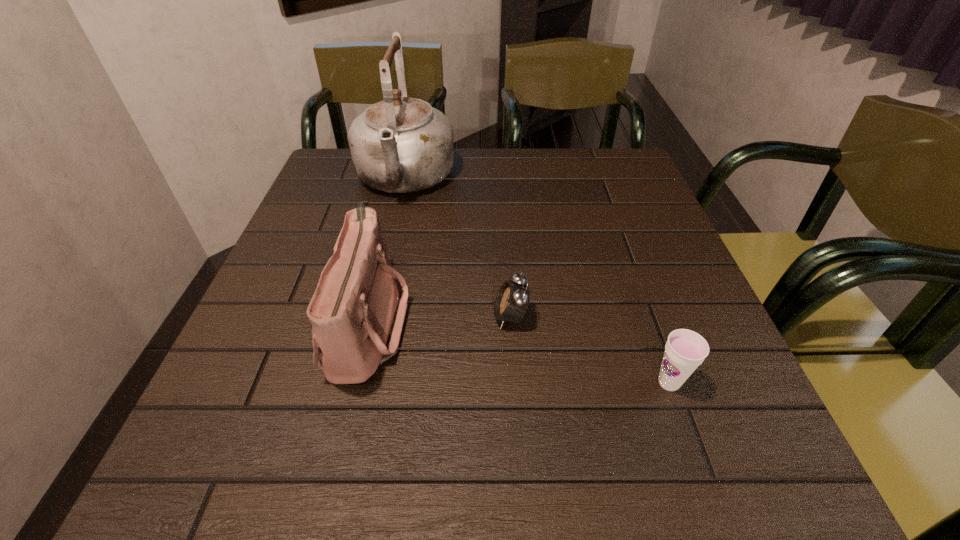
Identify the location of vacant space at the far left corner of the desktop. (347, 152).

Identify the location of vacant space at the far right corner of the desktop. The image size is (960, 540). (634, 185).

You are a GUI agent. You are given a task and a screenshot of the screen. Output one action in this format:
    pyautogui.click(x=<x>, y=<y>)
    Task: Click on the vacant space that is in between the alarm clock and the shoulder bag
    The height and width of the screenshot is (540, 960).
    Given the screenshot: What is the action you would take?
    click(x=439, y=319)

Identify the location of vacant space that is in between the kettle and the third object from left to right. This screenshot has width=960, height=540. (457, 248).

I want to click on empty space that is in between the kettle and the alarm clock, so click(457, 248).

The width and height of the screenshot is (960, 540). I want to click on blank region between the second object from right to left and the kettle, so click(x=457, y=248).

Where is `vacant area between the alarm clock and the cup`? vacant area between the alarm clock and the cup is located at coordinates (589, 350).

Find the location of a particular element. free space between the farthest object and the rightmost object is located at coordinates (537, 281).

You are a GUI agent. You are given a task and a screenshot of the screen. Output one action in this format:
    pyautogui.click(x=<x>, y=<y>)
    Task: Click on the vacant space that is in between the cup and the second object from right to left
    
    Given the screenshot: What is the action you would take?
    pyautogui.click(x=589, y=350)

What are the coordinates of `empty space between the shoulder bag and the second object from right to left` in the screenshot? It's located at (439, 319).